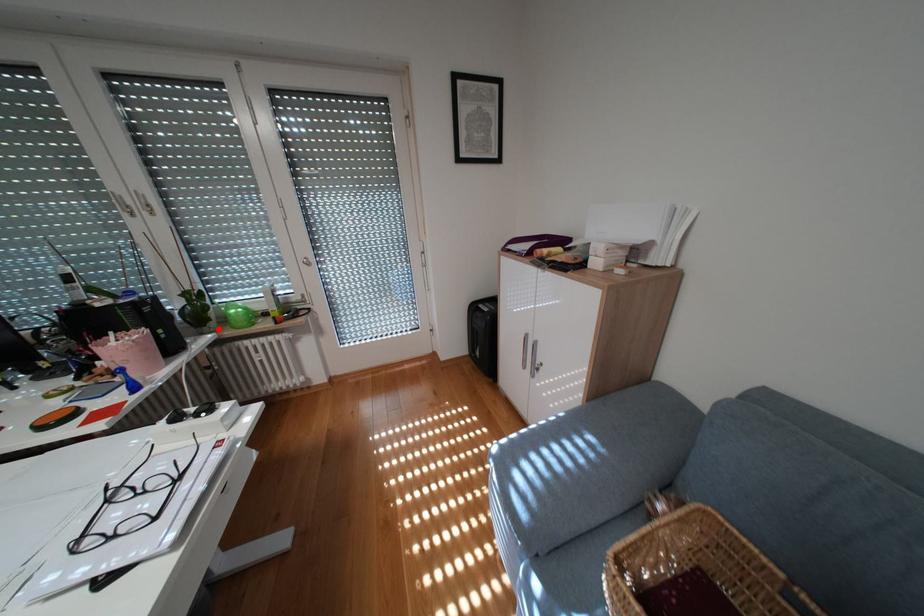
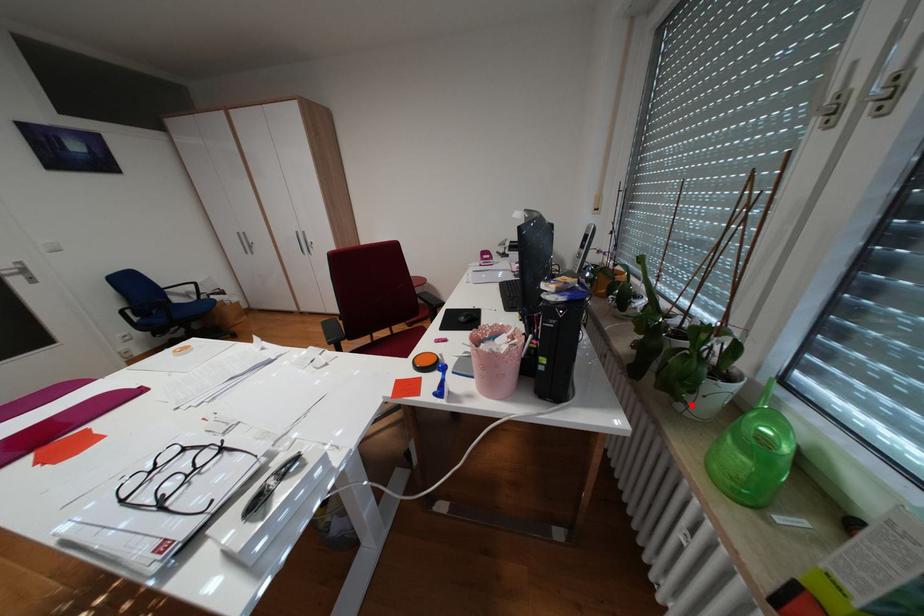
I am providing you with two images of the same scene from different viewpoints. A red point is marked on the first image and another point is marked on the second image. Is the red point in image1 aligned with the point shown in image2?

Yes